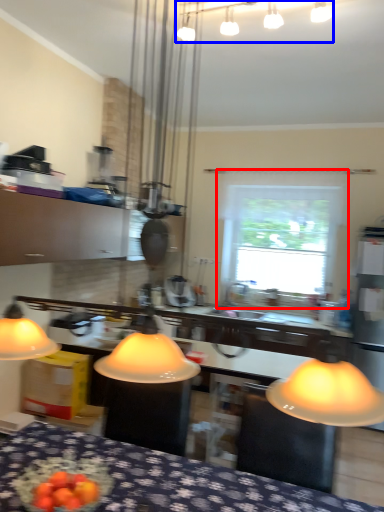
Question: Which object appears farthest to the camera in this image, window (highlighted by a red box) or lamp (highlighted by a blue box)?

Choices:
 (A) window
 (B) lamp

Answer: (A)